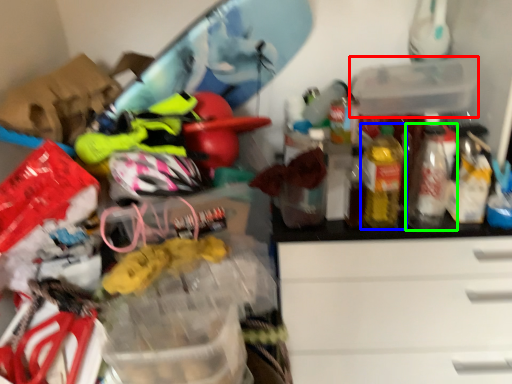
Question: Which object is positioned farthest from storage box (highlighted by a red box)? Select from bottle (highlighted by a blue box) and bottle (highlighted by a green box).

Choices:
 (A) bottle
 (B) bottle

Answer: (B)